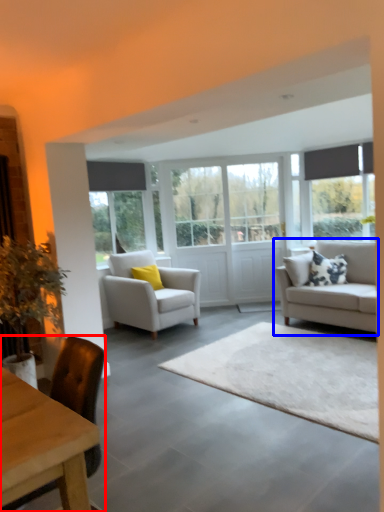
Question: Which object is closer to the camera taking this photo, chair (highlighted by a red box) or studio couch (highlighted by a blue box)?

Choices:
 (A) chair
 (B) studio couch

Answer: (A)